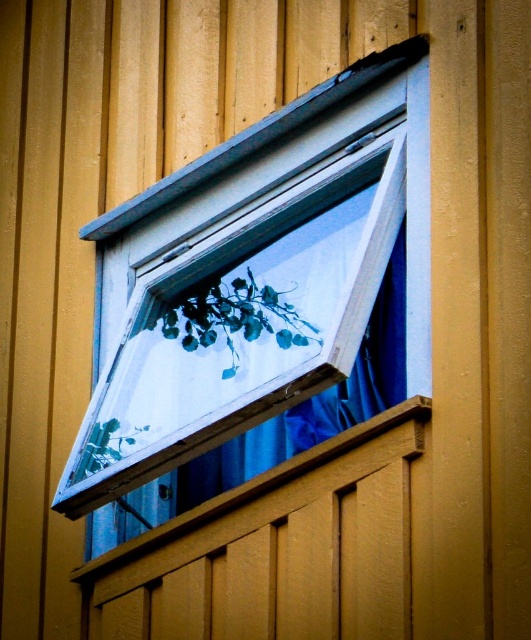
You are standing outside the window and want to water both the green matte plant at center and the green leafy plant at lower left. Which plant should you water first if you want to reach the one closer to you?

The green matte plant at center is in front of the green leafy plant at lower left, so you should water the green matte plant at center first as it is closer to you.

You are standing outside a building and see a white plastic window frame at upper center. There is a point marked at coordinates (261, 275). Is the point located on the white plastic window frame at upper center?

Yes, the point at (261, 275) is located on the white plastic window frame at upper center as stated in the description.

You are an interior designer assessing the space. You need to install a new decorative element between the white plastic window frame at upper center and the wooden at lower center. Considering their sizes, which object should you place closer to the smaller one to maintain balance?

The white plastic window frame at upper center has a smaller size compared to wooden at lower center. To maintain balance, place the decorative element closer to the white plastic window frame at upper center so that it visually compensates for the size difference.